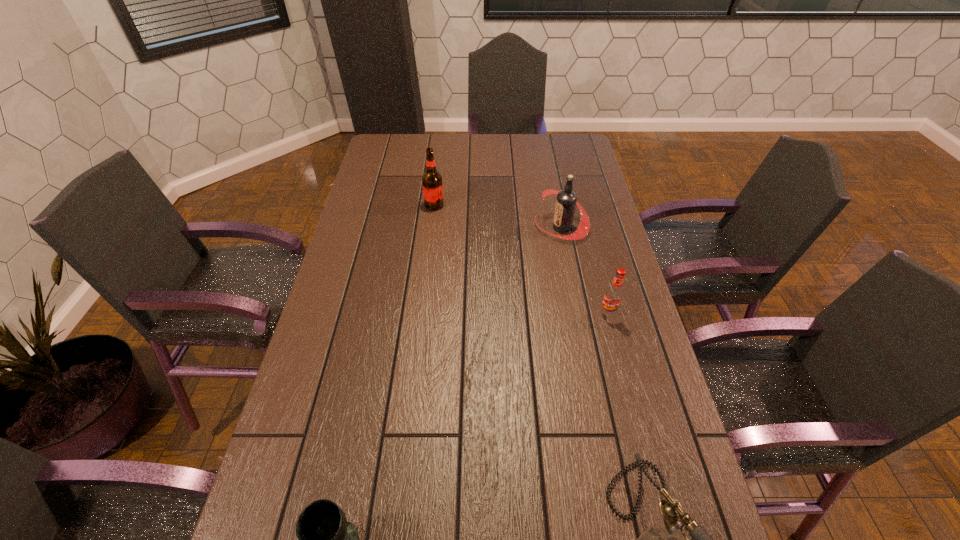
You are a GUI agent. You are given a task and a screenshot of the screen. Output one action in this format:
    pyautogui.click(x=<x>, y=<y>)
    Task: Click on the second object from left to right
    Image resolution: width=960 pixels, height=540 pixels.
    Given the screenshot: What is the action you would take?
    tap(432, 186)

Where is `the farthest root beer`? the farthest root beer is located at coordinates (432, 186).

Locate an element on the screen. The width and height of the screenshot is (960, 540). the fourth nearest object is located at coordinates (566, 201).

Locate an element on the screen. This screenshot has height=540, width=960. the nearest root beer is located at coordinates (613, 296).

Identify the location of the shortest root beer. (613, 296).

In order to click on free space located on the front of the farthest object in this screenshot , I will do `click(432, 224)`.

The height and width of the screenshot is (540, 960). What are the coordinates of `vacant area situated 0.270m on the label of the second nearest root beer` in the screenshot? It's located at (457, 227).

Locate an element on the screen. This screenshot has height=540, width=960. free space located on the label of the second nearest root beer is located at coordinates (503, 227).

Where is `free space located 0.280m on the label of the second nearest root beer`? Image resolution: width=960 pixels, height=540 pixels. free space located 0.280m on the label of the second nearest root beer is located at coordinates (454, 227).

The image size is (960, 540). Identify the location of vacant space located on the front of the nearest root beer. (636, 421).